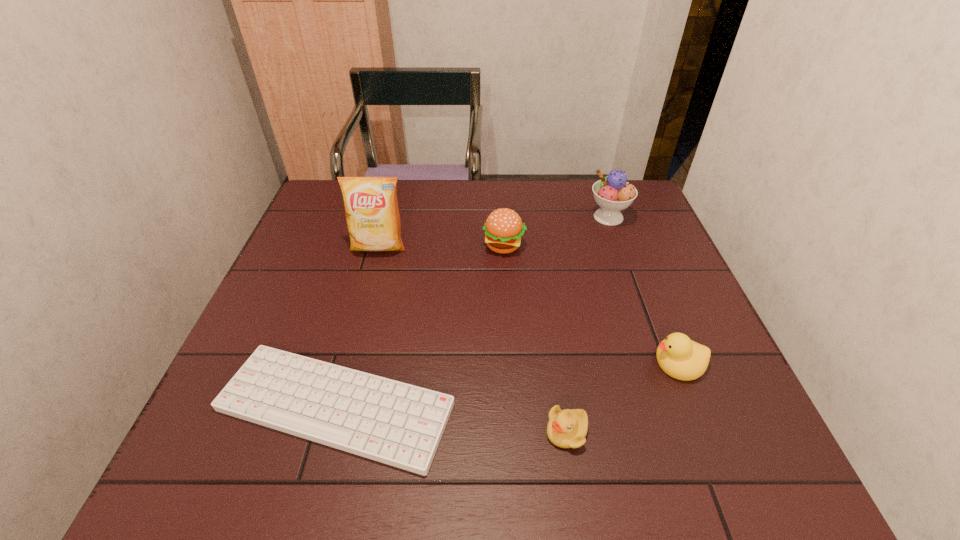
The image size is (960, 540). Find the location of `duckling located at the near edge`. duckling located at the near edge is located at coordinates (567, 428).

Identify the location of computer keyboard that is at the near edge. Image resolution: width=960 pixels, height=540 pixels. (395, 423).

Find the location of a particular element. The image size is (960, 540). object at the left edge is located at coordinates (395, 423).

In order to click on icecream positioned at the right edge in this screenshot , I will do `click(612, 193)`.

Locate an element on the screen. The image size is (960, 540). duckling that is positioned at the right edge is located at coordinates (681, 358).

This screenshot has width=960, height=540. I want to click on object at the near left corner, so click(395, 423).

Where is `object that is at the far right corner`? This screenshot has width=960, height=540. object that is at the far right corner is located at coordinates (612, 193).

Identify the location of vacant space at the far edge of the desktop. The height and width of the screenshot is (540, 960). (506, 193).

Find the location of a particular element. The width and height of the screenshot is (960, 540). blank space at the near edge of the desktop is located at coordinates pyautogui.click(x=522, y=453).

Locate an element on the screen. vacant space at the left edge of the desktop is located at coordinates (290, 292).